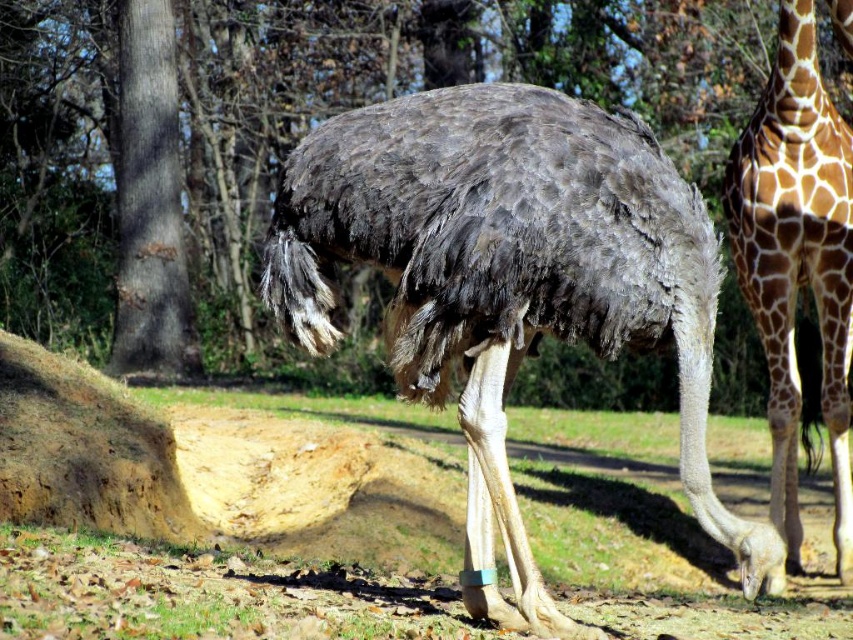
Is gray feathered ostrich at center behind gray rough bark tree at center?

No, it is not.

Is point (653, 161) positioned in front of point (151, 16)?

Yes, point (653, 161) is closer to viewer.

The height and width of the screenshot is (640, 853). Find the location of `gray feathered ostrich at center`. gray feathered ostrich at center is located at coordinates (508, 282).

Is gray feathered ostrich at center wider than brown spotted fur at right?

Correct, the width of gray feathered ostrich at center exceeds that of brown spotted fur at right.

Identify the location of gray feathered ostrich at center. (508, 282).

Between point (540, 198) and point (819, 172), which one is positioned behind?

The point (819, 172) is more distant.

Find the location of a particular element. This screenshot has width=853, height=640. gray feathered ostrich at center is located at coordinates (508, 282).

Is brown spotted fur at right below gray rough bark tree at center?

Indeed, brown spotted fur at right is positioned under gray rough bark tree at center.

Between point (843, 211) and point (165, 74), which one is positioned in front?

Point (843, 211)

Which is in front, point (780, 288) or point (160, 54)?

Point (780, 288) is more forward.

Where is `brown spotted fur at right`? brown spotted fur at right is located at coordinates (798, 260).